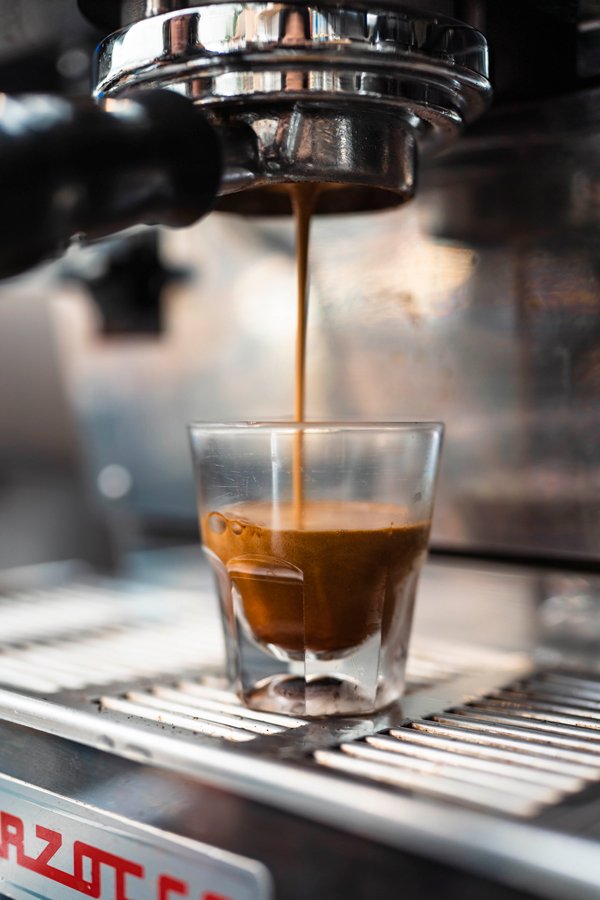
You are a GUI agent. You are given a task and a screenshot of the screen. Output one action in this format:
    pyautogui.click(x=<x>, y=<y>)
    Task: Click on the coffee in glass
    
    Given the screenshot: What is the action you would take?
    pyautogui.click(x=346, y=552), pyautogui.click(x=253, y=536), pyautogui.click(x=402, y=536)